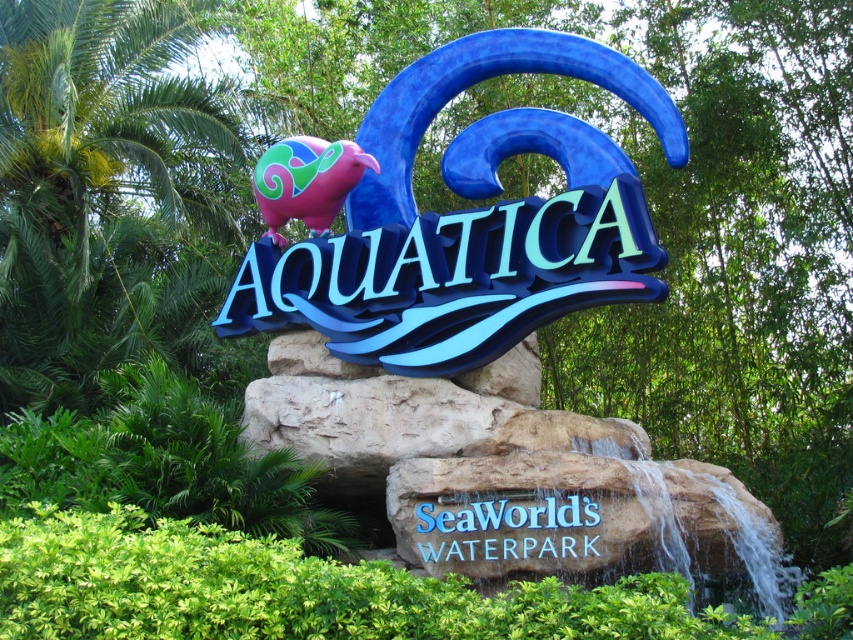
Between glossy plastic sign at center and blue plastic sign at center, which one has more height?

glossy plastic sign at center is taller.

Is point (473, 228) closer to viewer compared to point (587, 513)?

That is False.

This screenshot has width=853, height=640. Find the location of `glossy plastic sign at center`. glossy plastic sign at center is located at coordinates (469, 220).